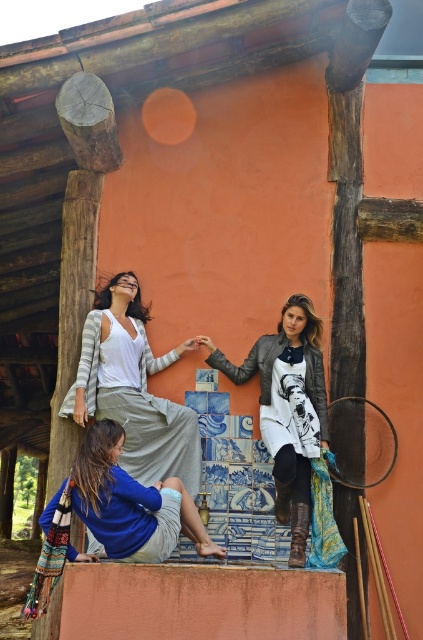
The width and height of the screenshot is (423, 640). What do you see at coordinates (132, 388) in the screenshot? I see `striped knit cardigan at upper left` at bounding box center [132, 388].

Describe the element at coordinates (132, 388) in the screenshot. I see `striped knit cardigan at upper left` at that location.

Image resolution: width=423 pixels, height=640 pixels. Find the location of `striped knit cardigan at upper left`. striped knit cardigan at upper left is located at coordinates [x=132, y=388].

Who is shorter, striped knit cardigan at upper left or leather jacket at center?

striped knit cardigan at upper left

Is striped knit cardigan at upper left positioned before leather jacket at center?

No, it is not.

Is point (98, 397) more distant than point (288, 483)?

Yes, point (98, 397) is behind point (288, 483).

The width and height of the screenshot is (423, 640). Find the location of `striped knit cardigan at upper left`. striped knit cardigan at upper left is located at coordinates (132, 388).

Can you confirm if leather jacket at center is positioned to the left of blue cotton shirt at lower left?

Incorrect, leather jacket at center is not on the left side of blue cotton shirt at lower left.

Who is more forward, (271, 420) or (82, 499)?

Point (82, 499)

Identify the location of leather jacket at center. (288, 408).